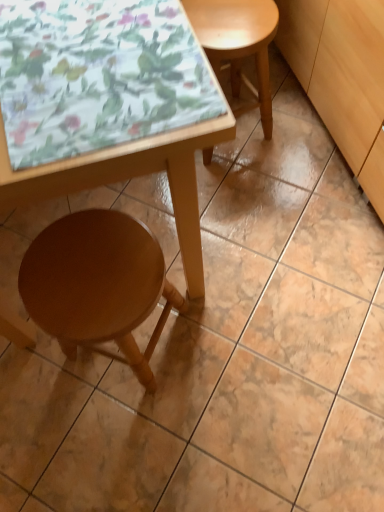
Question: Based on their sizes in the image, would you say wooden table at lower left is bigger or smaller than light wood cabinet at lower right?

Choices:
 (A) big
 (B) small

Answer: (A)

Question: In terms of height, does wooden table at lower left look taller or shorter compared to light wood cabinet at lower right?

Choices:
 (A) tall
 (B) short

Answer: (A)

Question: Estimate the real-world distances between objects in this image. Which object is farther from the light wood cabinet at lower right?

Choices:
 (A) wooden table at lower left
 (B) wooden stool at lower left, which ranks as the second stool in top-to-bottom order
 (C) light brown wood stool at upper right, which is the second stool from left to right

Answer: (B)

Question: Which of these objects is positioned closest to the light brown wood stool at upper right, the first stool viewed from the top?

Choices:
 (A) wooden stool at lower left, the first stool viewed from the left
 (B) light wood cabinet at lower right
 (C) wooden table at lower left

Answer: (B)